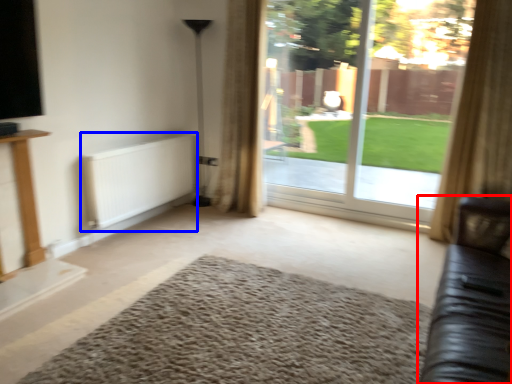
Question: Which of the following is the farthest to the observer, studio couch (highlighted by a red box) or radiator (highlighted by a blue box)?

Choices:
 (A) studio couch
 (B) radiator

Answer: (B)